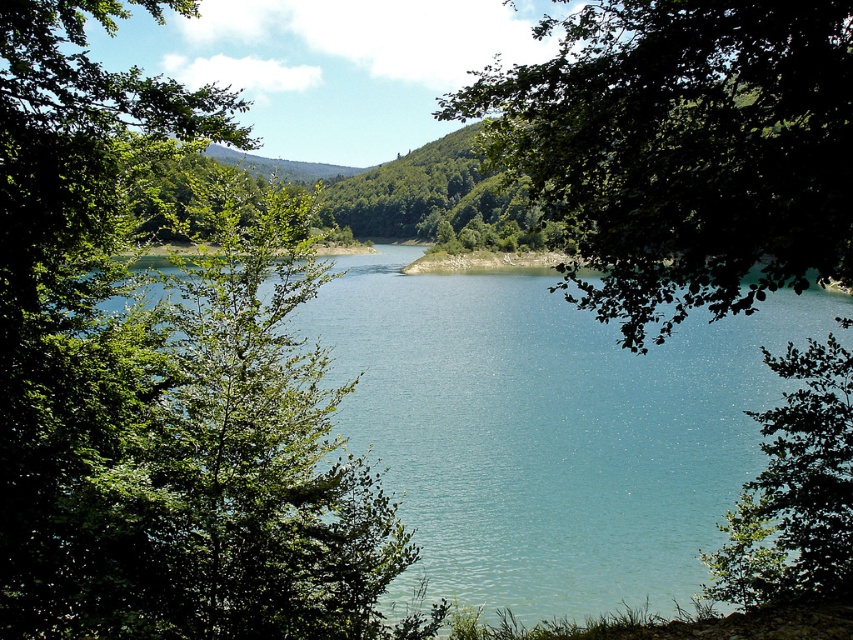
You are standing in the serene landscape and want to take a photo of the green leafy tree at left. If your camera has a maximum focus range of 5 meters, will it be able to capture the tree clearly?

The green leafy tree at left and camera are 5.18 meters apart from each other, which exceeds the camera maximum focus range of 5 meters. Therefore, the camera cannot capture the tree clearly.